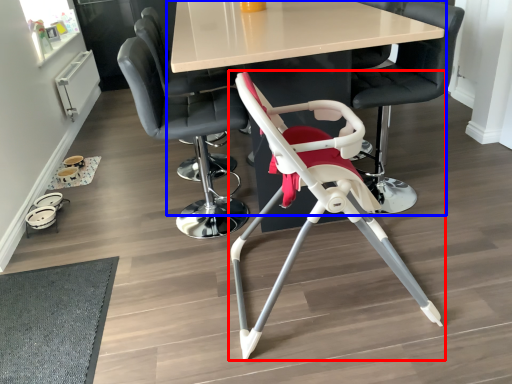
Question: Which object is closer to the camera taking this photo, chair (highlighted by a red box) or table (highlighted by a blue box)?

Choices:
 (A) chair
 (B) table

Answer: (A)